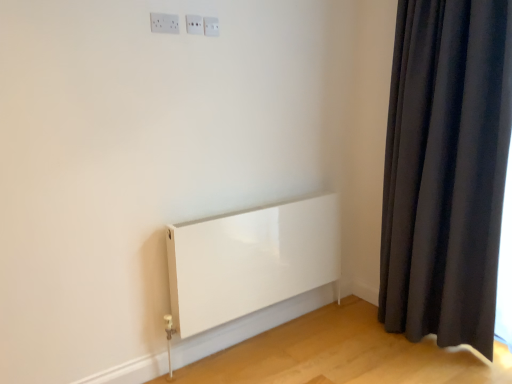
Question: Considering the relative sizes of white plastic electric outlet at upper center, the 1th electric outlet positioned from the right, and white glossy electric outlet at upper center, the 1th electric outlet positioned from the front, in the image provided, is white plastic electric outlet at upper center, the 1th electric outlet positioned from the right, taller than white glossy electric outlet at upper center, the 1th electric outlet positioned from the front,?

Choices:
 (A) no
 (B) yes

Answer: (A)

Question: Is white plastic electric outlet at upper center, which is the third electric outlet in left-to-right order, not within white glossy electric outlet at upper center, arranged as the 3th electric outlet when viewed from the back?

Choices:
 (A) yes
 (B) no

Answer: (A)

Question: From a real-world perspective, is white plastic electric outlet at upper center, which is the third electric outlet in left-to-right order, located higher than white glossy electric outlet at upper center, which appears as the third electric outlet when viewed from the right?

Choices:
 (A) no
 (B) yes

Answer: (B)

Question: Can you confirm if white plastic electric outlet at upper center, the 1th electric outlet positioned from the right, is thinner than white glossy electric outlet at upper center, arranged as the 3th electric outlet when viewed from the back?

Choices:
 (A) no
 (B) yes

Answer: (B)

Question: Is white plastic electric outlet at upper center, which ranks as the 3th electric outlet in front-to-back order, further to the viewer compared to white glossy electric outlet at upper center, the first electric outlet in the left-to-right sequence?

Choices:
 (A) yes
 (B) no

Answer: (A)

Question: From their relative heights in the image, would you say white plastic electric outlet at upper center, marked as the second electric outlet in a front-to-back arrangement, is taller or shorter than white plastic electric outlet at upper center, the 1th electric outlet positioned from the right?

Choices:
 (A) short
 (B) tall

Answer: (B)

Question: Visually, is white plastic electric outlet at upper center, arranged as the second electric outlet when viewed from the left, positioned to the left or to the right of white plastic electric outlet at upper center, which ranks as the 3th electric outlet in front-to-back order?

Choices:
 (A) right
 (B) left

Answer: (B)

Question: Does point (202, 24) appear closer or farther from the camera than point (204, 18)?

Choices:
 (A) farther
 (B) closer

Answer: (B)

Question: From a real-world perspective, is white plastic electric outlet at upper center, arranged as the 2th electric outlet when viewed from the back, above or below white plastic electric outlet at upper center, which is the third electric outlet in left-to-right order?

Choices:
 (A) above
 (B) below

Answer: (A)

Question: Is white glossy electric outlet at upper center, which appears as the third electric outlet when viewed from the right, spatially inside white plastic electric outlet at upper center, which ranks as the first electric outlet in back-to-front order, or outside of it?

Choices:
 (A) outside
 (B) inside

Answer: (A)

Question: Considering the positions of point (163, 23) and point (204, 26), is point (163, 23) closer or farther from the camera than point (204, 26)?

Choices:
 (A) closer
 (B) farther

Answer: (A)

Question: Is white glossy electric outlet at upper center, which appears as the third electric outlet when viewed from the right, bigger or smaller than white plastic electric outlet at upper center, which ranks as the 3th electric outlet in front-to-back order?

Choices:
 (A) small
 (B) big

Answer: (B)

Question: From the image's perspective, is white glossy electric outlet at upper center, arranged as the 3th electric outlet when viewed from the back, above or below white plastic electric outlet at upper center, the 1th electric outlet positioned from the right?

Choices:
 (A) below
 (B) above

Answer: (A)

Question: From a real-world perspective, relative to white plastic electric outlet at upper center, arranged as the 2th electric outlet when viewed from the back, is white plastic electric outlet at upper center, which ranks as the 3th electric outlet in front-to-back order, vertically above or below?

Choices:
 (A) above
 (B) below

Answer: (B)

Question: Considering the relative positions of white plastic electric outlet at upper center, which ranks as the 3th electric outlet in front-to-back order, and white plastic electric outlet at upper center, arranged as the second electric outlet when viewed from the left, in the image provided, is white plastic electric outlet at upper center, which ranks as the 3th electric outlet in front-to-back order, to the left or to the right of white plastic electric outlet at upper center, arranged as the second electric outlet when viewed from the left,?

Choices:
 (A) left
 (B) right

Answer: (B)